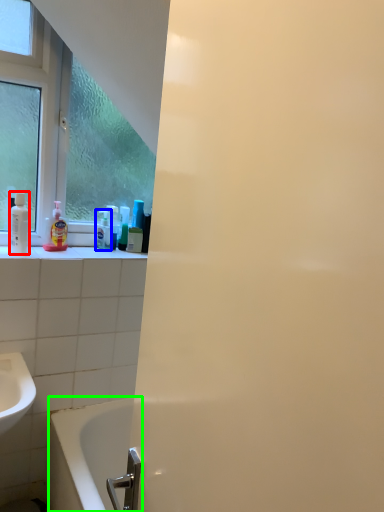
Question: Considering the real-world distances, which object is farthest from mouthwash (highlighted by a red box)? cleaning product (highlighted by a blue box) or bathtub (highlighted by a green box)?

Choices:
 (A) cleaning product
 (B) bathtub

Answer: (B)